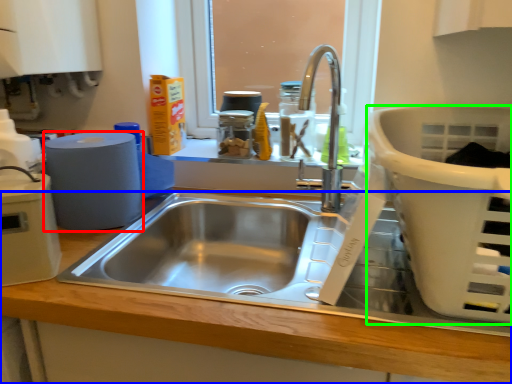
Question: Considering the real-world distances, which object is closest to paper towel (highlighted by a red box)? counter top (highlighted by a blue box) or basket (highlighted by a green box).

Choices:
 (A) counter top
 (B) basket

Answer: (A)